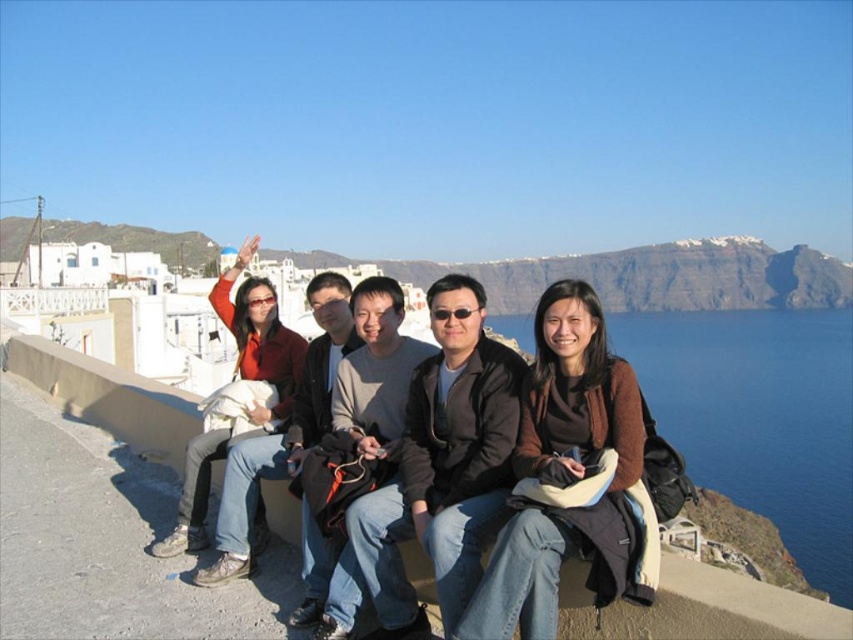
Who is more forward, (x=730, y=380) or (x=544, y=525)?

Positioned in front is point (x=544, y=525).

Between blue water at upper right and brown fuzzy sweater at center, which one has less height?

brown fuzzy sweater at center is shorter.

Is point (753, 467) in front of point (548, 310)?

No, (753, 467) is behind (548, 310).

What are the coordinates of `blue water at upper right` in the screenshot? It's located at (759, 419).

From the picture: Can you confirm if brown fuzzy sweater at center is smaller than dark gray jacket at center?

Actually, brown fuzzy sweater at center might be larger than dark gray jacket at center.

Which is in front, point (480, 634) or point (334, 570)?

Positioned in front is point (480, 634).

Between point (561, 392) and point (352, 545), which one is positioned in front?

Positioned in front is point (352, 545).

Identify the location of brown fuzzy sweater at center. (566, 476).

Does brown fuzzy sweater at center come in front of matte red jacket at left?

Yes, brown fuzzy sweater at center is closer to the viewer.

Does brown fuzzy sweater at center have a greater height compared to matte red jacket at left?

Incorrect, brown fuzzy sweater at center's height is not larger of matte red jacket at left's.

This screenshot has height=640, width=853. Find the location of `brown fuzzy sweater at center`. brown fuzzy sweater at center is located at coordinates (566, 476).

In order to click on brown fuzzy sweater at center in this screenshot , I will do `click(566, 476)`.